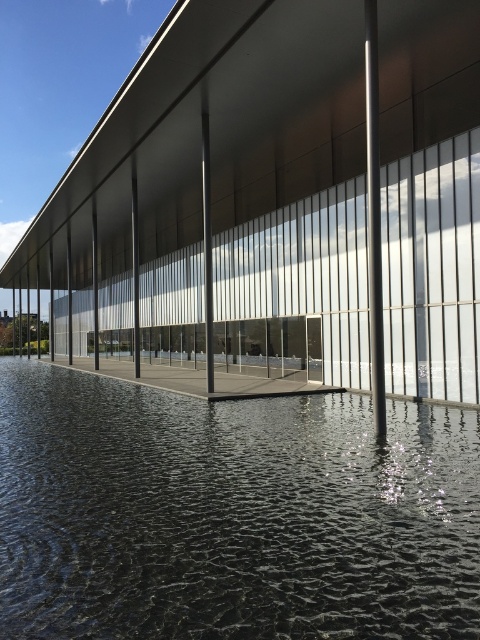
Question: Which object appears farthest from the camera in this image?

Choices:
 (A) black reflective water at center
 (B) polished metal pole at center

Answer: (B)

Question: Does black reflective water at center appear over polished metal pole at center?

Choices:
 (A) yes
 (B) no

Answer: (B)

Question: Which point is farther to the camera?

Choices:
 (A) polished metal pole at center
 (B) black reflective water at center

Answer: (A)

Question: Does black reflective water at center appear on the left side of polished metal pole at center?

Choices:
 (A) yes
 (B) no

Answer: (A)

Question: Can you confirm if black reflective water at center is positioned below polished metal pole at center?

Choices:
 (A) no
 (B) yes

Answer: (B)